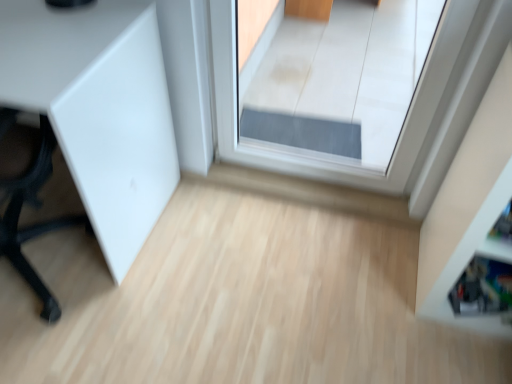
What do you see at coordinates (334, 90) in the screenshot? I see `transparent glass door at center` at bounding box center [334, 90].

At what (x,y) coordinates should I click in order to perform the action: click on white matte cabinet at left. Please return your answer as a coordinate pair (x, y). Looking at the image, I should click on (98, 108).

How many degrees apart are the facing directions of white matte cabinet at left and transparent glass door at center?

The angle between the facing direction of white matte cabinet at left and the facing direction of transparent glass door at center is 0.696 degrees.

From the image's perspective, is white matte cabinet at left above or below transparent glass door at center?

white matte cabinet at left is situated lower than transparent glass door at center in the image.

Does white matte cabinet at left come behind transparent glass door at center?

No, white matte cabinet at left is closer to the camera.

Considering the sizes of objects white matte cabinet at left and transparent glass door at center in the image provided, who is wider, white matte cabinet at left or transparent glass door at center?

white matte cabinet at left is wider.

Is white glossy shelf at right wider than transparent glass door at center?

Indeed, white glossy shelf at right has a greater width compared to transparent glass door at center.

Are white glossy shelf at right and transparent glass door at center located far from each other?

Indeed, white glossy shelf at right is not near transparent glass door at center.

Is white glossy shelf at right aimed at transparent glass door at center?

No, white glossy shelf at right is not facing towards transparent glass door at center.

Does point (493, 193) come closer to viewer compared to point (382, 20)?

Yes, it is.

How different are the orientations of white glossy shelf at right and white matte cabinet at left in degrees?

2.7 degrees.

Does point (476, 230) come farther from viewer compared to point (163, 202)?

That is False.

Locate an element on the screen. The width and height of the screenshot is (512, 384). furniture on the left of white glossy shelf at right is located at coordinates (98, 108).

Is white glossy shelf at right wider or thinner than white matte cabinet at left?

In the image, white glossy shelf at right appears to be more narrow than white matte cabinet at left.

Can you tell me how much transparent glass door at center and white glossy shelf at right differ in facing direction?

The facing directions of transparent glass door at center and white glossy shelf at right are 2.01 degrees apart.

Considering the sizes of transparent glass door at center and white glossy shelf at right in the image, is transparent glass door at center bigger or smaller than white glossy shelf at right?

Considering their sizes, transparent glass door at center takes up less space than white glossy shelf at right.

Considering their positions, is transparent glass door at center located in front of or behind white glossy shelf at right?

Visually, transparent glass door at center is located behind white glossy shelf at right.

Which object is positioned more to the right, transparent glass door at center or white glossy shelf at right?

white glossy shelf at right.

From the picture: Which is less distant, [54,77] or [426,308]?

Positioned in front is point [54,77].

Consider the image. How different are the orientations of white matte cabinet at left and white glossy shelf at right in degrees?

The angular difference between white matte cabinet at left and white glossy shelf at right is 2.7 degrees.

Is white matte cabinet at left spatially inside white glossy shelf at right, or outside of it?

white matte cabinet at left exists outside the volume of white glossy shelf at right.

Can you confirm if white matte cabinet at left is shorter than white glossy shelf at right?

Indeed, white matte cabinet at left has a lesser height compared to white glossy shelf at right.

Can we say transparent glass door at center lies outside white matte cabinet at left?

Yes, transparent glass door at center is outside of white matte cabinet at left.

From a real-world perspective, does transparent glass door at center stand above white matte cabinet at left?

Yes, from a real-world perspective, transparent glass door at center is on top of white matte cabinet at left.

From the image's perspective, is transparent glass door at center on top of white matte cabinet at left?

Indeed, from the image's perspective, transparent glass door at center is shown above white matte cabinet at left.

Does point (438, 2) come in front of point (82, 19)?

That is False.

Identify the location of furniture on the left of transparent glass door at center. (98, 108).

Find the location of `shelf that appears below the transparent glass door at center (from the image's perspective)`. shelf that appears below the transparent glass door at center (from the image's perspective) is located at coordinates (468, 263).

When comparing their distances from white matte cabinet at left, does white glossy shelf at right or transparent glass door at center seem further?

white glossy shelf at right lies further to white matte cabinet at left than the other object.

Which object lies further to the anchor point white glossy shelf at right, white matte cabinet at left or transparent glass door at center?

Among the two, transparent glass door at center is located further to white glossy shelf at right.

Consider the image. Which object lies nearer to the anchor point transparent glass door at center, white matte cabinet at left or white glossy shelf at right?

Based on the image, white matte cabinet at left appears to be nearer to transparent glass door at center.

Looking at the image, which one is located closer to transparent glass door at center, white glossy shelf at right or white matte cabinet at left?

white matte cabinet at left is closer to transparent glass door at center.

Looking at the image, which one is located further to white matte cabinet at left, transparent glass door at center or white glossy shelf at right?

Based on the image, white glossy shelf at right appears to be further to white matte cabinet at left.

Which object lies further to the anchor point white glossy shelf at right, transparent glass door at center or white matte cabinet at left?

transparent glass door at center is positioned further to the anchor white glossy shelf at right.

Image resolution: width=512 pixels, height=384 pixels. What are the coordinates of `window between white matte cabinet at left and white glossy shelf at right` in the screenshot? It's located at (334, 90).